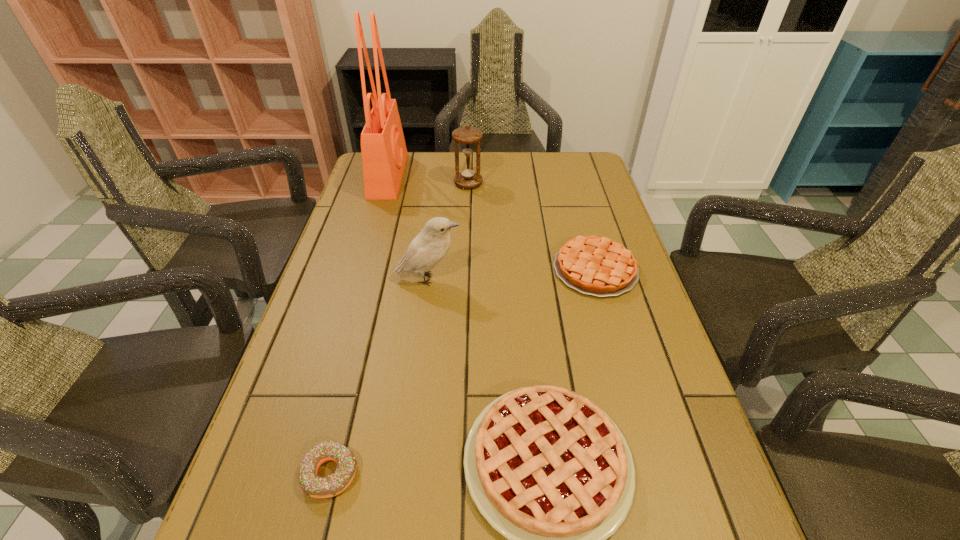
The height and width of the screenshot is (540, 960). Identify the location of the tallest object. (384, 154).

At what (x,y) coordinates should I click in order to perform the action: click on bird. Please return your answer as a coordinate pair (x, y). The height and width of the screenshot is (540, 960). Looking at the image, I should click on (427, 249).

You are a GUI agent. You are given a task and a screenshot of the screen. Output one action in this format:
    pyautogui.click(x=<x>, y=<y>)
    Task: Click on the hourglass
    Image resolution: width=960 pixels, height=540 pixels.
    Given the screenshot: What is the action you would take?
    pyautogui.click(x=469, y=177)

The height and width of the screenshot is (540, 960). I want to click on the farther pie, so click(x=598, y=266).

Identify the location of doughnut. Image resolution: width=960 pixels, height=540 pixels. (313, 485).

Where is `vacant space located on the logo side of the tallest object`? The height and width of the screenshot is (540, 960). vacant space located on the logo side of the tallest object is located at coordinates (x=478, y=176).

Find the location of a particular element. vacant space situated at the beak of the bird is located at coordinates pos(533,279).

Identify the location of free space located 0.050m on the left of the hourglass. This screenshot has width=960, height=540. (439, 183).

Locate an element on the screen. This screenshot has width=960, height=540. vacant space located 0.390m on the back of the farther pie is located at coordinates click(x=567, y=172).

Where is `free spot located 0.070m on the back of the doughnut`? This screenshot has height=540, width=960. free spot located 0.070m on the back of the doughnut is located at coordinates (346, 413).